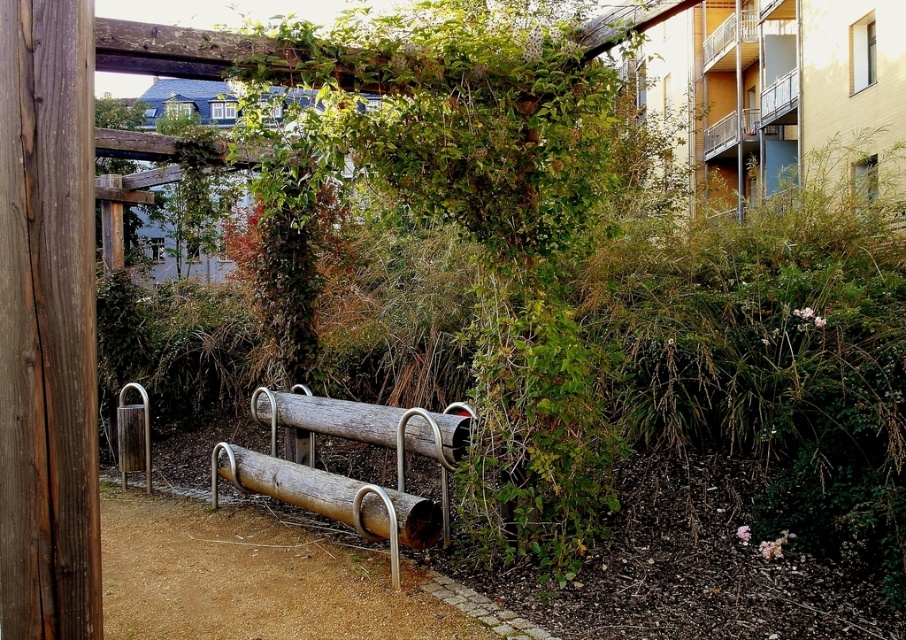
Between rusty metal log at center and brown wood log at center, which one has less height?

With less height is brown wood log at center.

Can you confirm if rusty metal log at center is taller than brown wood log at center?

Indeed, rusty metal log at center has a greater height compared to brown wood log at center.

Where is `rusty metal log at center`? The height and width of the screenshot is (640, 906). rusty metal log at center is located at coordinates (331, 496).

Is brown wood pole at left wider than rusty metal log at center?

No.

Which is more to the left, brown wood pole at left or rusty metal log at center?

From the viewer's perspective, brown wood pole at left appears more on the left side.

Who is more forward, (82, 557) or (403, 509)?

Point (82, 557) is in front.

The image size is (906, 640). Find the location of `brown wood pole at left`. brown wood pole at left is located at coordinates (47, 323).

Who is positioned more to the left, brown wood pole at left or brown wood log at center?

From the viewer's perspective, brown wood pole at left appears more on the left side.

Can you confirm if brown wood pole at left is wider than brown wood log at center?

No.

I want to click on brown wood pole at left, so click(47, 323).